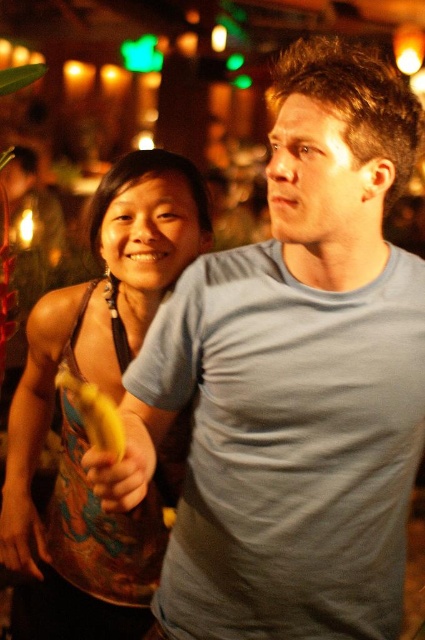
You are standing in the bar and want to take a photo of the multicolored fabric dress at left. Where should you position yourself to capture the dress in the frame?

To capture the multicolored fabric dress at left in the frame, position yourself so that the dress is centered at coordinates approximately 0.623 on the horizontal axis and 0.266 on the vertical axis.